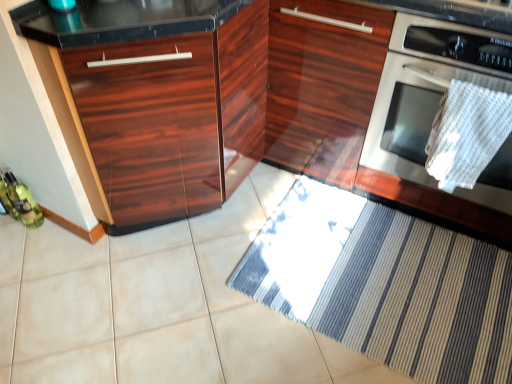
Identify the location of vacant region to the left of striped fabric doormat at lower center. This screenshot has height=384, width=512. (199, 289).